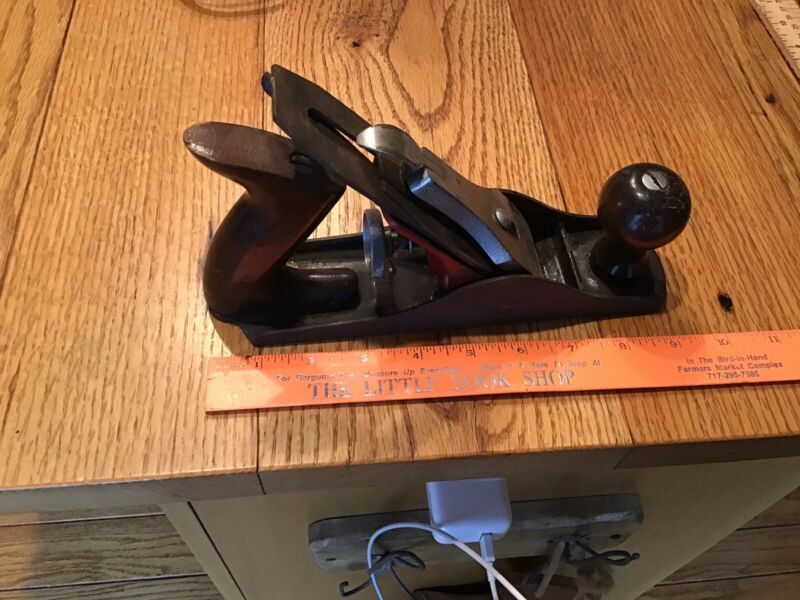
Find the location of `front edge of table`. front edge of table is located at coordinates (366, 477).